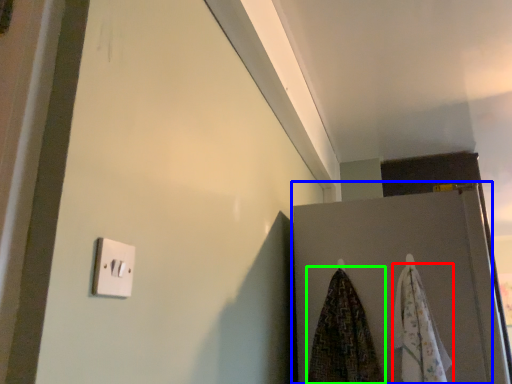
Question: Based on their relative distances, which object is farther from beach towel (highlighted by a red box)? Choose from door (highlighted by a blue box) and beach towel (highlighted by a green box).

Choices:
 (A) door
 (B) beach towel

Answer: (B)